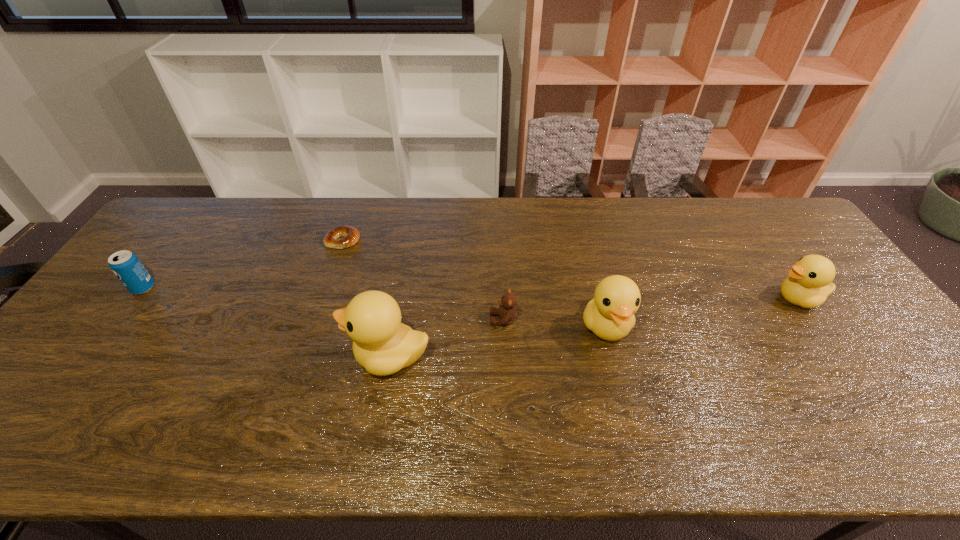
Where is `the third object from left to right`? The image size is (960, 540). the third object from left to right is located at coordinates (383, 345).

Where is `the second shortest duck`? This screenshot has width=960, height=540. the second shortest duck is located at coordinates (610, 314).

At what (x,y) coordinates should I click in order to perform the action: click on the second duck from right to left. Please return your answer as a coordinate pair (x, y). This screenshot has width=960, height=540. Looking at the image, I should click on (610, 314).

Where is `the shortest duck`? This screenshot has height=540, width=960. the shortest duck is located at coordinates (809, 283).

What are the coordinates of `the fourth shortest object` in the screenshot? It's located at (809, 283).

The height and width of the screenshot is (540, 960). What are the coordinates of `the farthest object` in the screenshot? It's located at (340, 237).

Identify the location of the second object from left to right. This screenshot has height=540, width=960. (340, 237).

Where is `the leftmost object`? the leftmost object is located at coordinates (127, 267).

The image size is (960, 540). Find the location of `the fourth tallest object`. the fourth tallest object is located at coordinates (127, 267).

This screenshot has height=540, width=960. Find the location of `the second shortest object`. the second shortest object is located at coordinates (507, 312).